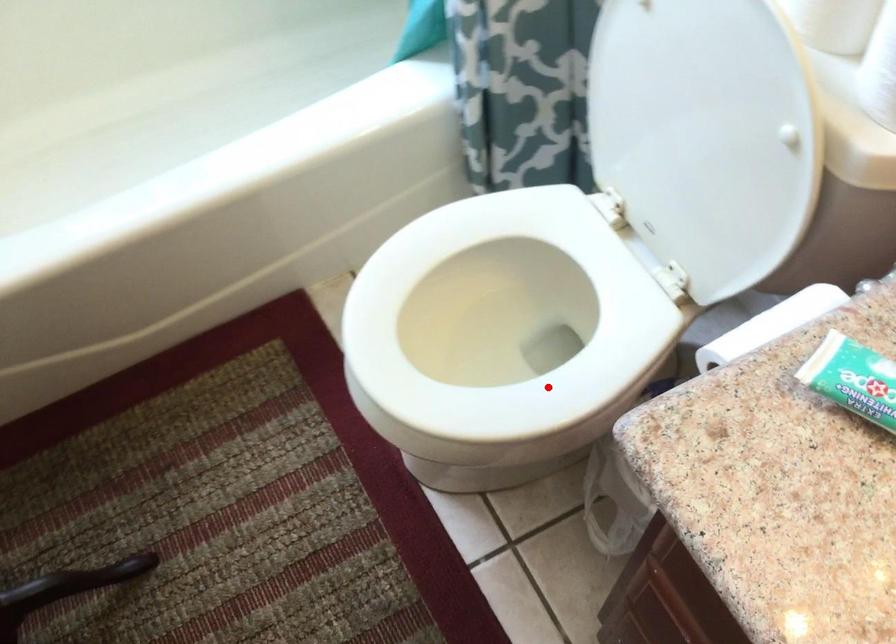
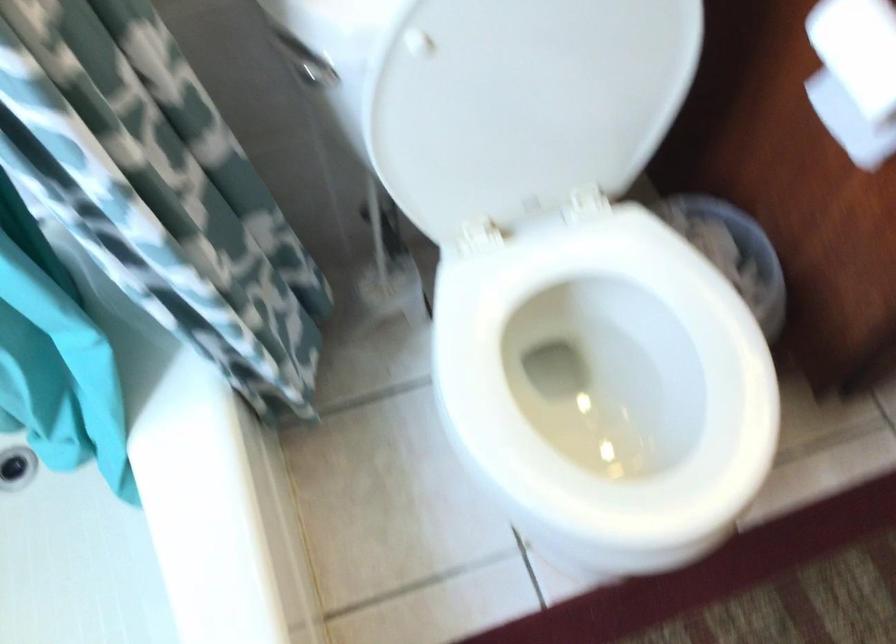
Question: I am providing you with two images of the same scene from different viewpoints. Given a red point in image1, look at the same physical point in image2. Is it:

Choices:
 (A) Closer to the viewpoint
 (B) Farther from the viewpoint

Answer: (B)